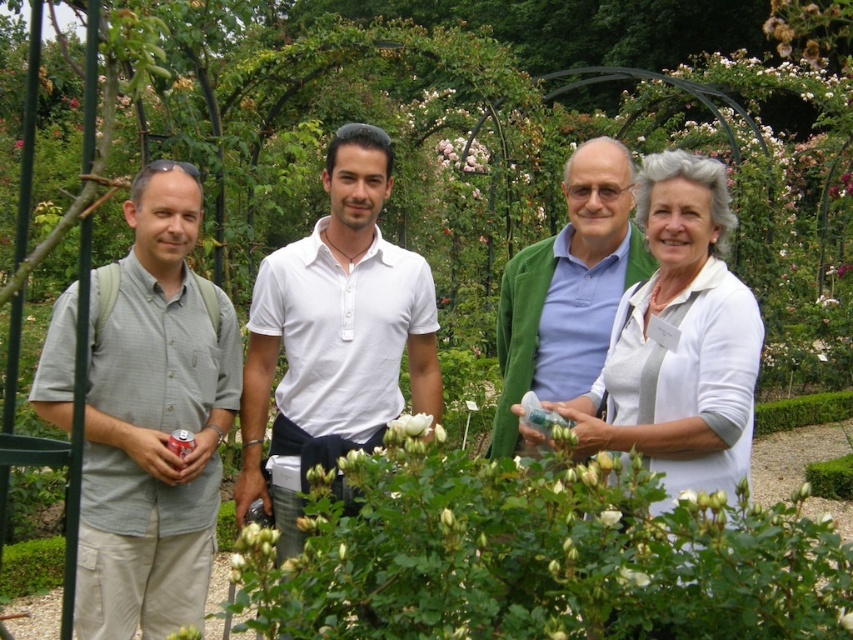
Question: Which point appears farthest from the camera in this image?

Choices:
 (A) (331, 614)
 (B) (142, 634)

Answer: (B)

Question: Is white cotton polo shirt at center closer to the viewer compared to blue cotton shirt at center?

Choices:
 (A) no
 (B) yes

Answer: (A)

Question: Which is nearer to the white matte jacket at center?

Choices:
 (A) blue cotton shirt at center
 (B) white matte rose bush at center
 (C) gray cotton shirt at left

Answer: (A)

Question: Among these objects, which one is nearest to the camera?

Choices:
 (A) blue cotton shirt at center
 (B) white matte jacket at center
 (C) white matte rose bush at center

Answer: (C)

Question: Is white matte rose bush at center below white matte flower at center?

Choices:
 (A) yes
 (B) no

Answer: (A)

Question: Is gray cotton shirt at left further to the viewer compared to blue cotton shirt at center?

Choices:
 (A) yes
 (B) no

Answer: (B)